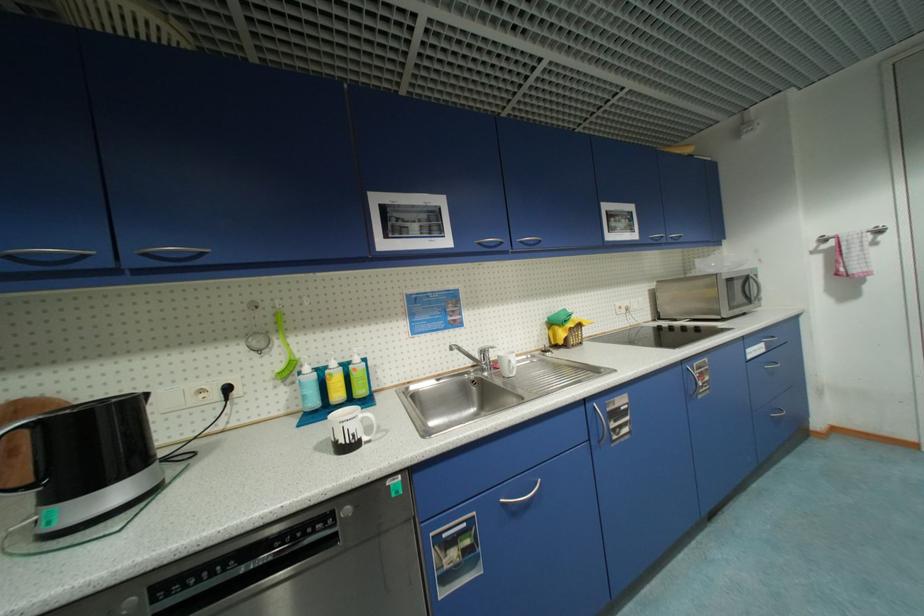
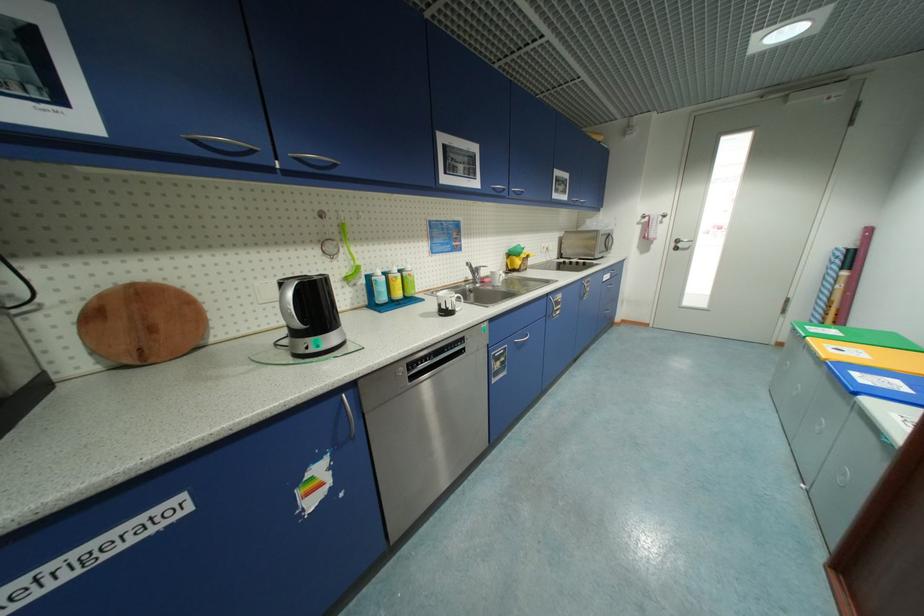
The point at (639,237) is marked in the first image. Where is the corresponding point in the second image?

(570, 199)